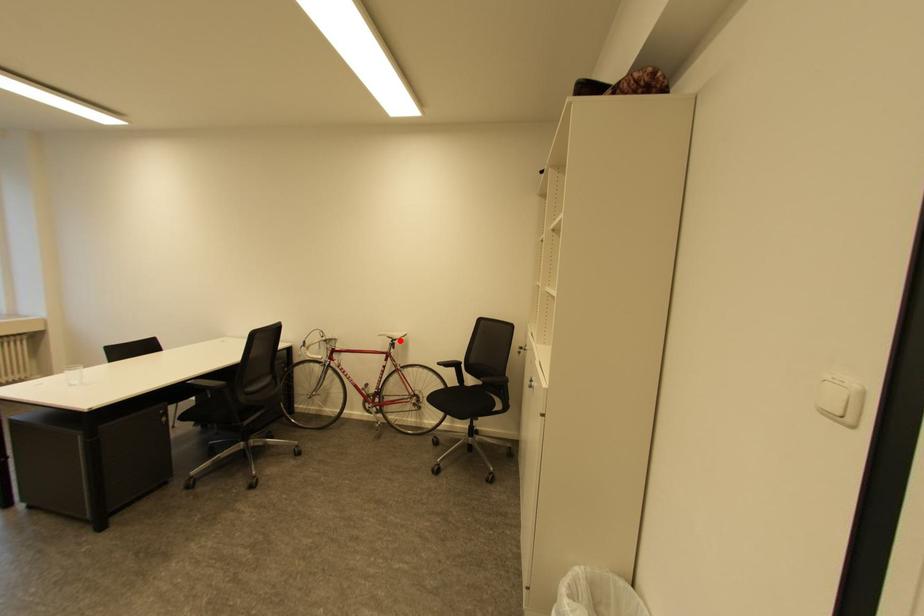
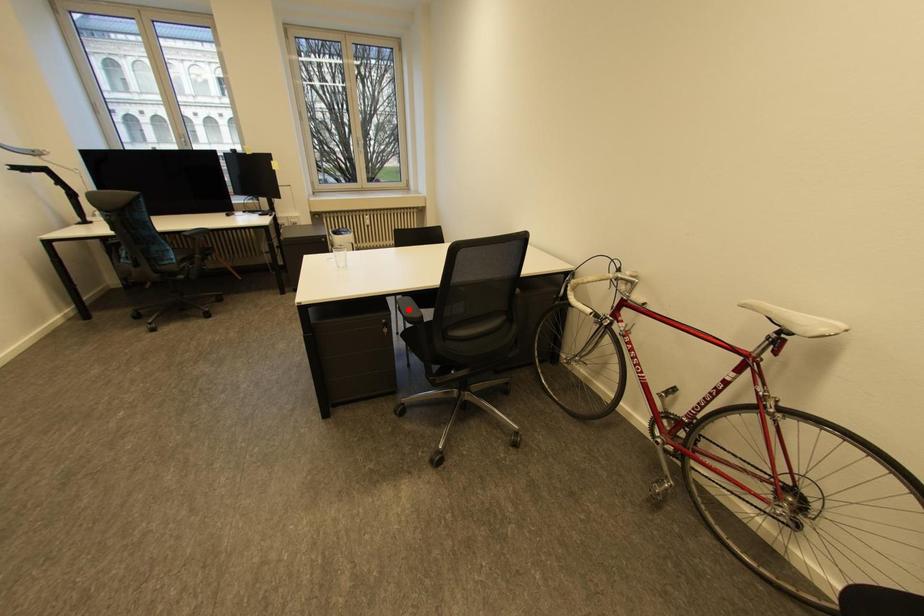
I am providing you with two images of the same scene from different viewpoints. A red point is marked on the first image and another point is marked on the second image. Are the points marked in image1 and image2 representing the same 3D position?

No